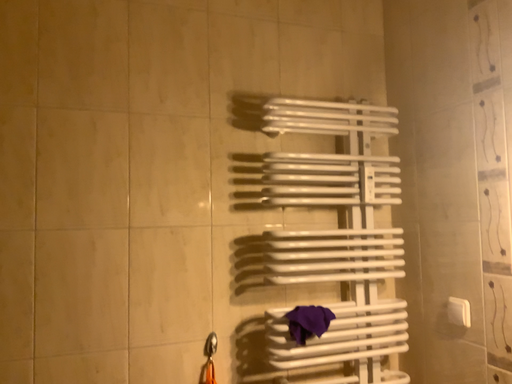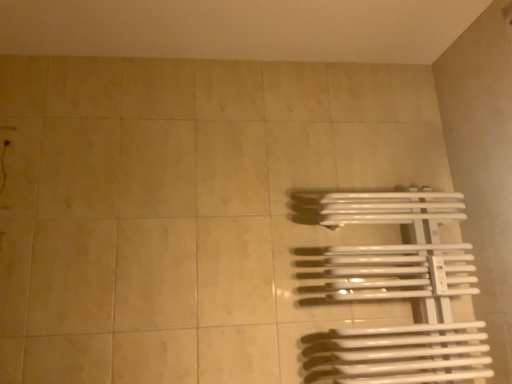
Question: How did the camera likely rotate when shooting the video?

Choices:
 (A) rotated downward
 (B) rotated upward

Answer: (B)